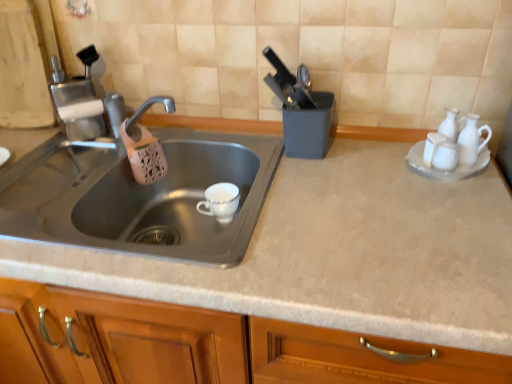
Question: Is white glossy salt shaker at upper right, which is the second tableware in left-to-right order, taller or shorter than white ceramic saucer at right?

Choices:
 (A) short
 (B) tall

Answer: (B)

Question: Considering the positions of white glossy salt shaker at upper right, positioned as the 2th tableware in right-to-left order, and white ceramic saucer at right in the image, is white glossy salt shaker at upper right, positioned as the 2th tableware in right-to-left order, wider or thinner than white ceramic saucer at right?

Choices:
 (A) thin
 (B) wide

Answer: (A)

Question: Which object is positioned closest to the white porcelain cup at sink, the 1th tableware viewed from the back?

Choices:
 (A) matte gray countertop at center
 (B) white glossy salt shaker at upper right, positioned as the second tableware in front-to-back order
 (C) white ceramic pitcher at right, which ranks as the first tableware in front-to-back order
 (D) stainless steel sink at left
 (E) white ceramic saucer at right

Answer: (D)

Question: Which is farther from the white ceramic saucer at right?

Choices:
 (A) matte gray countertop at center
 (B) white ceramic pitcher at right, which appears as the third tableware when viewed from the left
 (C) white porcelain cup at sink, positioned as the third tableware in right-to-left order
 (D) white glossy salt shaker at upper right, which is the second tableware in left-to-right order
 (E) matte plastic knife block at upper right

Answer: (C)